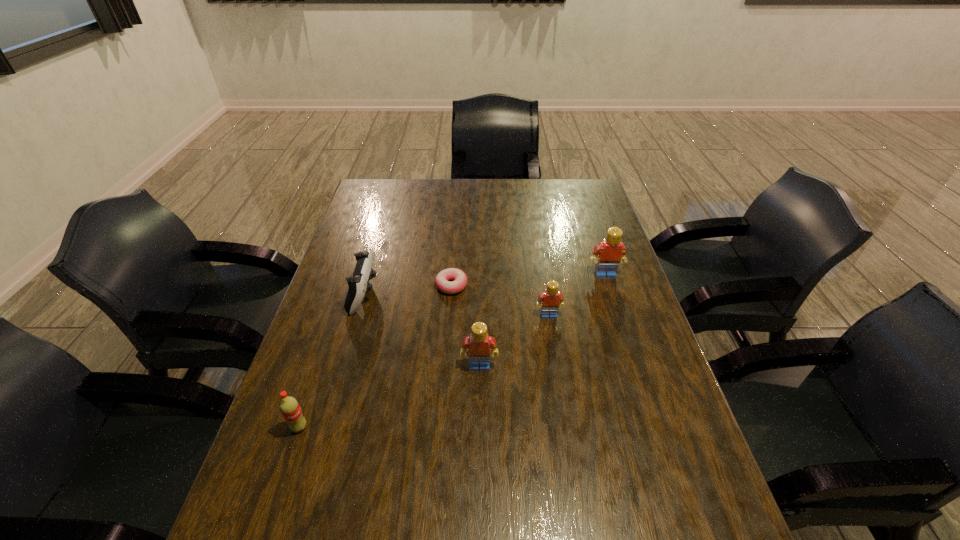
Identify the location of the second nearest object. This screenshot has width=960, height=540. (480, 346).

Locate an element on the screen. the second tallest Lego is located at coordinates click(480, 346).

Image resolution: width=960 pixels, height=540 pixels. What are the coordinates of `the second object from right to left` in the screenshot? It's located at (551, 299).

In order to click on the second Lego from right to left in this screenshot , I will do `click(551, 299)`.

At what (x,y) coordinates should I click in order to perform the action: click on the farthest Lego. Please return your answer as a coordinate pair (x, y). Image resolution: width=960 pixels, height=540 pixels. Looking at the image, I should click on (611, 251).

Identify the location of the rightmost object. Image resolution: width=960 pixels, height=540 pixels. (611, 251).

You are a GUI agent. You are given a task and a screenshot of the screen. Output one action in this format:
    pyautogui.click(x=<x>, y=<y>)
    Task: Click on the control
    
    Given the screenshot: What is the action you would take?
    pyautogui.click(x=358, y=283)

You are a GUI agent. You are given a task and a screenshot of the screen. Output one action in this format:
    pyautogui.click(x=<x>, y=<y>)
    Task: Click on the shortest object
    
    Given the screenshot: What is the action you would take?
    pyautogui.click(x=442, y=282)

Where is `soda`? soda is located at coordinates (289, 407).

Locate an element on the screen. the leftmost object is located at coordinates (289, 407).